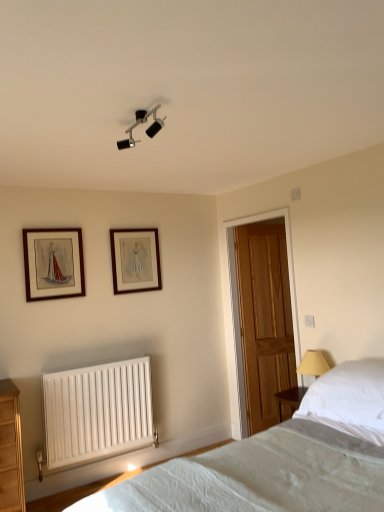
Find the location of a particular element. free space above matte black light fixture at upper center (from a real-world perspective) is located at coordinates (147, 108).